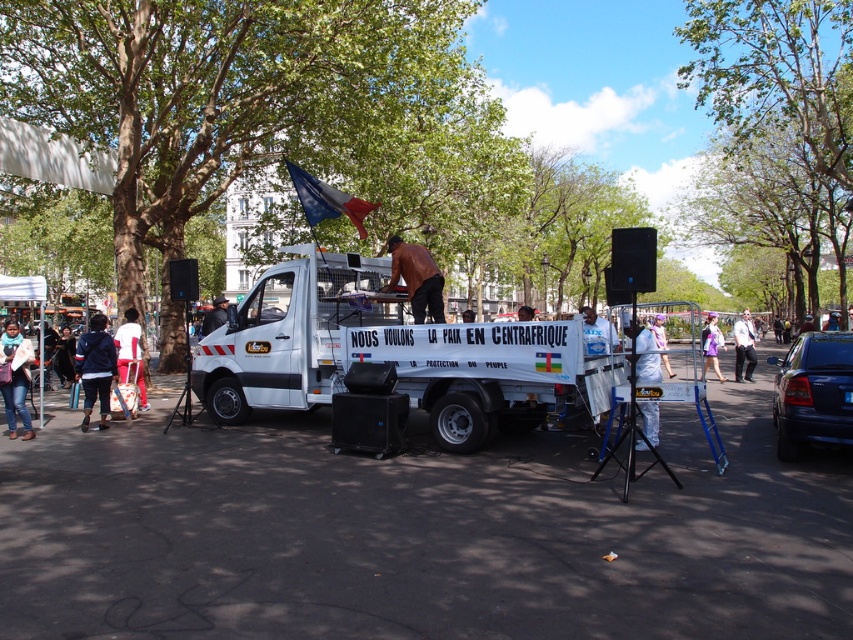
Based on the photo, measure the distance from green leafy tree at upper center to dark brown leather jacket at lower left.

A distance of 30.50 meters exists between green leafy tree at upper center and dark brown leather jacket at lower left.

Does green leafy tree at upper center have a larger size compared to dark brown leather jacket at lower left?

Correct, green leafy tree at upper center is larger in size than dark brown leather jacket at lower left.

Does point (781, 22) come in front of point (51, 356)?

No, it is behind (51, 356).

Where is `green leafy tree at upper center`? The width and height of the screenshot is (853, 640). green leafy tree at upper center is located at coordinates (776, 70).

Between white fabric bag at left and purple fabric dress at lower right, which one is positioned higher?

purple fabric dress at lower right is higher up.

Does white fabric bag at left appear on the right side of purple fabric dress at lower right?

In fact, white fabric bag at left is to the left of purple fabric dress at lower right.

Is point (119, 372) farther from camera compared to point (712, 330)?

That is False.

You are a GUI agent. You are given a task and a screenshot of the screen. Output one action in this format:
    pyautogui.click(x=<x>, y=<y>)
    Task: Click on the white fabric bag at left
    The image size is (853, 640).
    Given the screenshot: What is the action you would take?
    coord(131,353)

Who is lower down, white fabric bag at left or white shirt at center?

white fabric bag at left

How distant is white fabric bag at left from white shirt at center?

white fabric bag at left and white shirt at center are 16.29 meters apart.

Between point (125, 371) and point (744, 317), which one is positioned in front?

Point (125, 371) is in front.

This screenshot has height=640, width=853. I want to click on white fabric bag at left, so click(x=131, y=353).